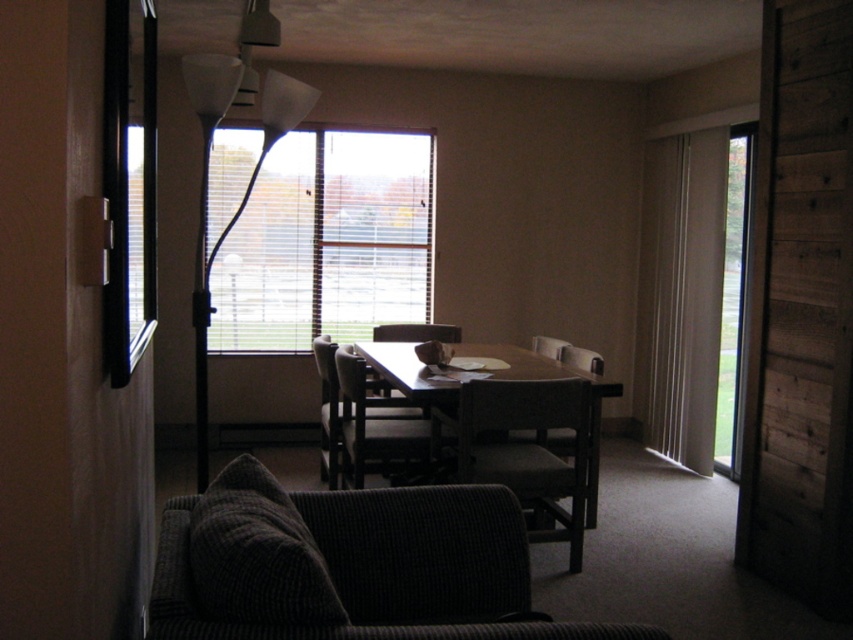
You are moving a large painting that is 8 feet wide. You want to hang it on the wall between the white plastic floor lamp at upper left and the matte brown chair at center. Is there enough space between them to fit the painting?

The distance between the white plastic floor lamp at upper left and the matte brown chair at center is 7.66 feet, which is less than the painting width of 8 feet. Therefore, there is not enough space to fit the painting between them.

You are standing in the living room and want to place a small plant between the two points marked as point (444, 324) and point (548, 346). Since you want the plant to be closer to you, which point should you place it near?

You should place the plant near point (444, 324) because it is closer to you compared to point (548, 346).